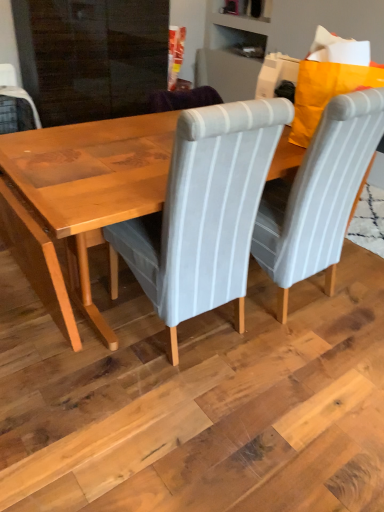
You are a GUI agent. You are given a task and a screenshot of the screen. Output one action in this format:
    pyautogui.click(x=<x>, y=<y>)
    Task: Click on the free space to the right of gray striped fabric chair at center, the 1th chair in the right-to-left sequence
    This screenshot has width=384, height=512.
    Given the screenshot: What is the action you would take?
    pyautogui.click(x=356, y=292)